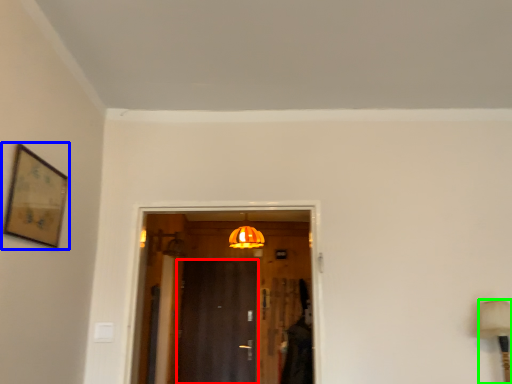
Question: Estimate the real-world distances between objects in this image. Which object is closer to door (highlighted by a red box), picture frame (highlighted by a blue box) or table lamp (highlighted by a green box)?

Choices:
 (A) picture frame
 (B) table lamp

Answer: (B)